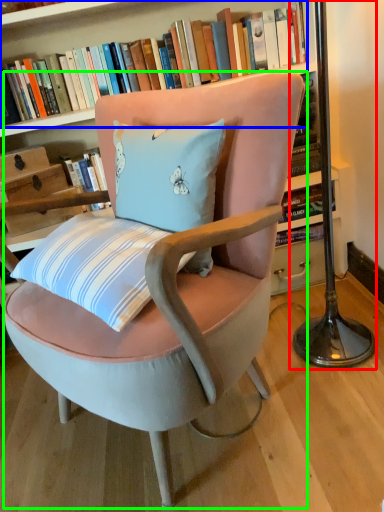
Question: Which object is positioned farthest from table lamp (highlighted by a red box)? Select from book (highlighted by a blue box) and chair (highlighted by a green box).

Choices:
 (A) book
 (B) chair

Answer: (A)